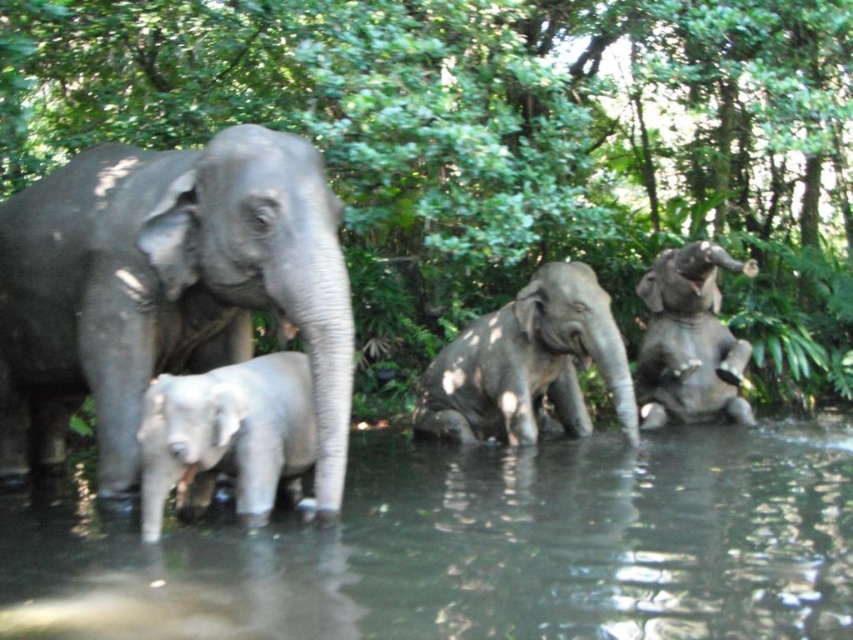
Question: Does clear water at creek left appear under gray matte elephant at lower left?

Choices:
 (A) yes
 (B) no

Answer: (A)

Question: Which point is farther to the camera?

Choices:
 (A) gray matte elephant at lower left
 (B) gray matte elephant at center
 (C) clear water at creek left
 (D) gray matte elephant at left

Answer: (B)

Question: Where is clear water at creek left located in relation to gray matte elephant at right in the image?

Choices:
 (A) below
 (B) above

Answer: (A)

Question: Estimate the real-world distances between objects in this image. Which object is closer to the gray matte elephant at right?

Choices:
 (A) gray matte elephant at left
 (B) clear water at creek left

Answer: (B)

Question: Among these objects, which one is farthest from the camera?

Choices:
 (A) gray matte elephant at right
 (B) gray matte elephant at left
 (C) clear water at creek left

Answer: (A)

Question: Can you confirm if gray matte elephant at left is positioned above gray matte elephant at lower left?

Choices:
 (A) no
 (B) yes

Answer: (B)